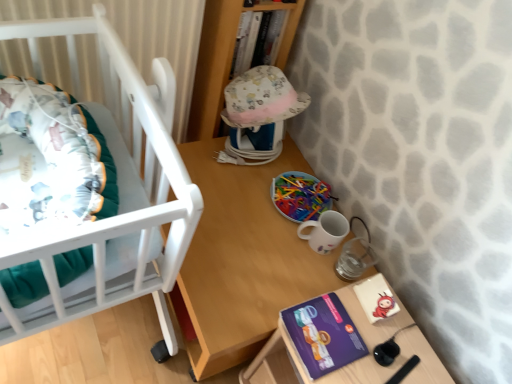
Question: Considering the positions of white glossy mug at lower right and purple cardboard box at lower right in the image, is white glossy mug at lower right taller or shorter than purple cardboard box at lower right?

Choices:
 (A) tall
 (B) short

Answer: (B)

Question: Considering the positions of point (330, 218) and point (288, 347), is point (330, 218) closer or farther from the camera than point (288, 347)?

Choices:
 (A) farther
 (B) closer

Answer: (A)

Question: Which object is the farthest from the purple cardboard box at lower right?

Choices:
 (A) multicolored plastic sticks at center
 (B) white glossy mug at lower right
 (C) hardcover book at upper center
 (D) wooden table at center
 (E) purple matte paperback book at lower right

Answer: (C)

Question: Which is nearer to the white glossy mug at lower right?

Choices:
 (A) hardcover book at upper center
 (B) wooden table at center
 (C) purple matte paperback book at lower right
 (D) multicolored plastic sticks at center
 (E) purple cardboard box at lower right

Answer: (D)